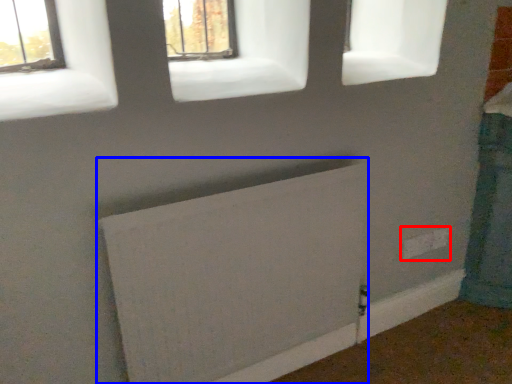
Question: Which point is further to the camera, electric outlet (highlighted by a red box) or radiator (highlighted by a blue box)?

Choices:
 (A) electric outlet
 (B) radiator

Answer: (A)